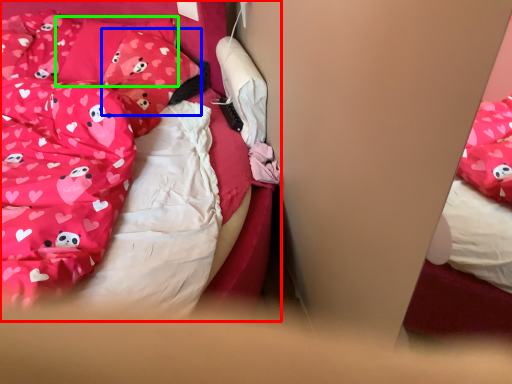
Question: Based on their relative distances, which object is farther from bed (highlighted by a red box)? Choose from pillow (highlighted by a blue box) and pillow (highlighted by a green box).

Choices:
 (A) pillow
 (B) pillow

Answer: (B)